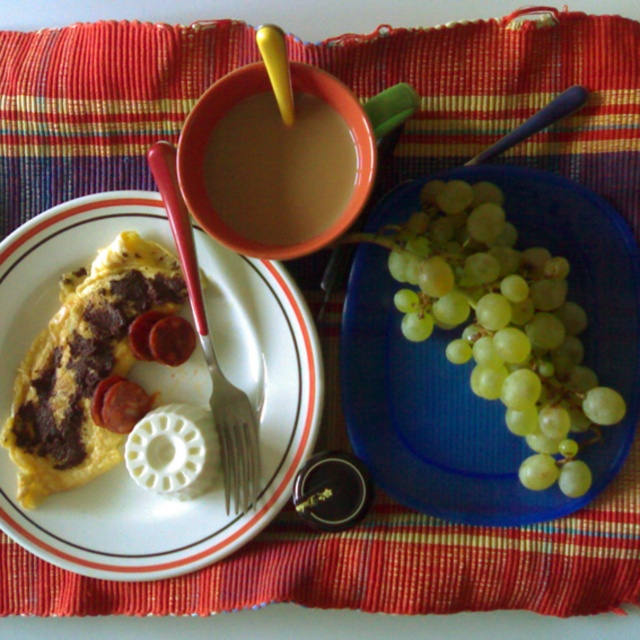
You are a chef preparing to serve a meal. The white glossy plate at upper left and the silver metallic fork at lower left are on the counter. You need to place the fork exactly 3 inches away from the plate. Is the current placement correct?

The distance between the white glossy plate at upper left and the silver metallic fork at lower left is 3.04 inches, which is slightly more than 3 inches. Therefore, the current placement is not exactly 3 inches apart. The fork should be moved closer to the plate by approximately 0.04 inches to meet the requirement.

You are a food critic standing at the edge of the table. You need to describe the location of the green matte grapes at right relative to the omelette with sausage and cheese. Where are they placed?

The green matte grapes at right are located at the right side of the image, positioned at coordinates point (502, 324) relative to the omelette with sausage and cheese.

You are setting up a table for a dinner party and need to arrange the white glossy plate at upper left and the silver metallic fork at lower left. Considering their heights, which item should be placed closer to the edge of the table to prevent it from tipping over?

The silver metallic fork at lower left should be placed closer to the edge of the table because it has a shorter height compared to the white glossy plate at upper left, making it more stable when positioned near the edge.